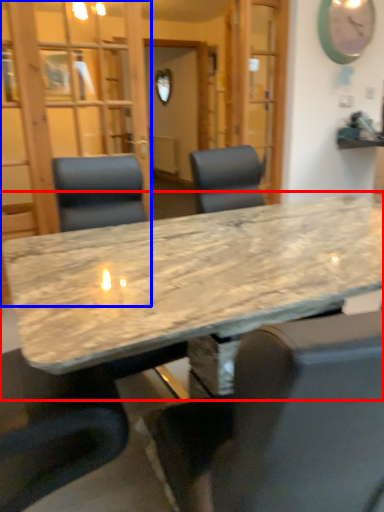
Question: Which object appears farthest to the camera in this image, table (highlighted by a red box) or glass door (highlighted by a blue box)?

Choices:
 (A) table
 (B) glass door

Answer: (B)